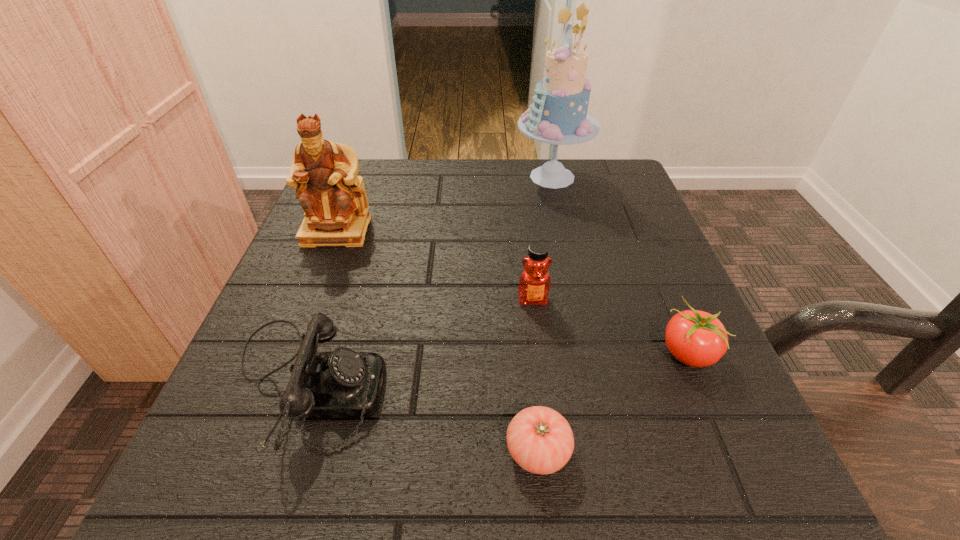
This screenshot has width=960, height=540. In order to click on empty location between the second tallest object and the telephone in this screenshot , I will do `click(321, 307)`.

The height and width of the screenshot is (540, 960). Find the location of `free space that is in between the farthest object and the second farthest object`. free space that is in between the farthest object and the second farthest object is located at coordinates (444, 204).

At what (x,y) coordinates should I click in order to perform the action: click on vacant point located between the rightmost object and the shortest object. Please return your answer as a coordinate pair (x, y). The width and height of the screenshot is (960, 540). Looking at the image, I should click on (612, 402).

At what (x,y) coordinates should I click in order to perform the action: click on free space between the farthest object and the nearer tomato. Please return your answer as a coordinate pair (x, y). Looking at the image, I should click on click(545, 314).

I want to click on free space that is in between the telephone and the honey, so click(420, 342).

Locate an element on the screen. object that can be found as the fourth closest to the farthest object is located at coordinates (343, 383).

Choose which object is the fifth nearest neighbor to the telephone. Please provide its 2D coordinates. Your answer should be formatted as a tuple, i.e. [(x, y)], where the tuple contains the x and y coordinates of a point satisfying the conditions above.

[(558, 115)]

At what (x,y) coordinates should I click in order to perform the action: click on free location that satisfies the following two spatial constraints: 1. on the front label of the third farthest object; 2. on the left side of the farther tomato. Please return your answer as a coordinate pair (x, y). The height and width of the screenshot is (540, 960). Looking at the image, I should click on (540, 353).

The image size is (960, 540). Find the location of `vacant space that satisfies the following two spatial constraints: 1. on the front label of the third farthest object; 2. on the front-facing side of the telephone`. vacant space that satisfies the following two spatial constraints: 1. on the front label of the third farthest object; 2. on the front-facing side of the telephone is located at coordinates (543, 384).

Where is `vacant area in the image that satisfies the following two spatial constraints: 1. on the front-facing side of the farther tomato; 2. on the right side of the fifth nearest object`? vacant area in the image that satisfies the following two spatial constraints: 1. on the front-facing side of the farther tomato; 2. on the right side of the fifth nearest object is located at coordinates (289, 353).